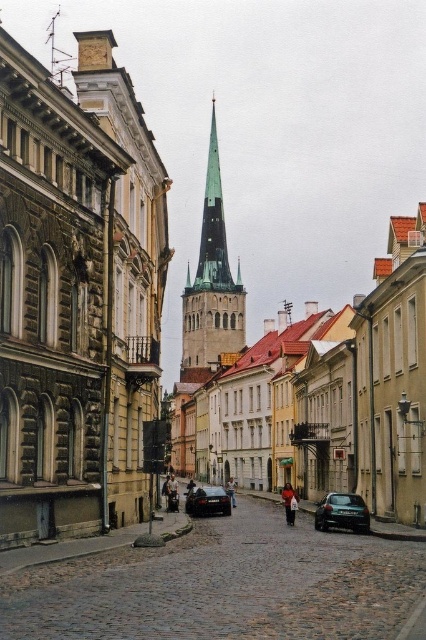
You are standing on the cobblestone street in front of the historic buildings. You want to take a photo of the green glass spire at center from where you are standing. Considering the distance, would you need a zoom lens to capture the entire spire in your photo?

The green glass spire at center is 467.17 feet away from you. At this distance, a zoom lens would be necessary to ensure the entire spire is captured in the photo without cropping.

You are standing on the cobblestone street and want to walk towards the church spire in the background. There are two points marked on the path ahead of you. One is at coordinates point (330,506) and the other is at point (221,493). Which point should you aim for first if you want to reach the spire quickly?

You should aim for point (221,493) first because point (330,506) is in front of it, meaning point (221,493) is closer to the church spire and thus the better path to reach it quickly.

You are standing at the entrance of the historic European town and see the shiny dark blue car at center. There is a parking spot 55.96 meters away from it. Can you walk to the parking spot in 1 minute if your walking speed is 1.5 m per second?

The distance between the shiny dark blue car at center and the parking spot is 55.96 meters. At a walking speed of 1.5 m per second, it would take approximately 37.3 seconds to reach the parking spot, which is within 1 minute. Therefore, yes, you can walk to the parking spot in 1 minute.